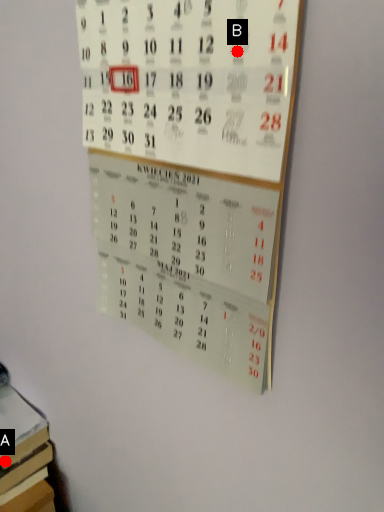
Question: Two points are circled on the image, labeled by A and B beside each circle. Among these points, which one is nearest to the camera?

Choices:
 (A) A is closer
 (B) B is closer

Answer: (B)